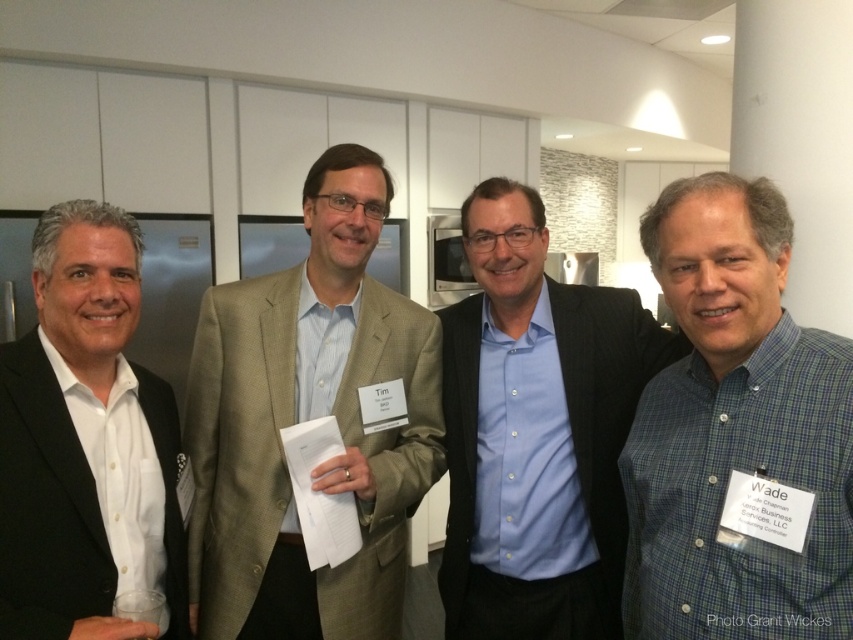
Question: Which of the following is the closest to the observer?

Choices:
 (A) (366, 324)
 (B) (583, 508)

Answer: (A)

Question: Which object is positioned closest to the black matte suit at left?

Choices:
 (A) light brown textured suit at center
 (B) blue button-down shirt at center
 (C) blue plaid shirt at center

Answer: (A)

Question: Is blue plaid shirt at center further to the viewer compared to black matte suit at left?

Choices:
 (A) yes
 (B) no

Answer: (B)

Question: Which point is closer to the camera taking this photo?

Choices:
 (A) (137, 528)
 (B) (670, 598)

Answer: (B)

Question: Observing the image, what is the correct spatial positioning of blue button-down shirt at center in reference to black matte suit at left?

Choices:
 (A) left
 (B) right

Answer: (B)

Question: Does blue plaid shirt at center have a larger size compared to blue button-down shirt at center?

Choices:
 (A) no
 (B) yes

Answer: (A)